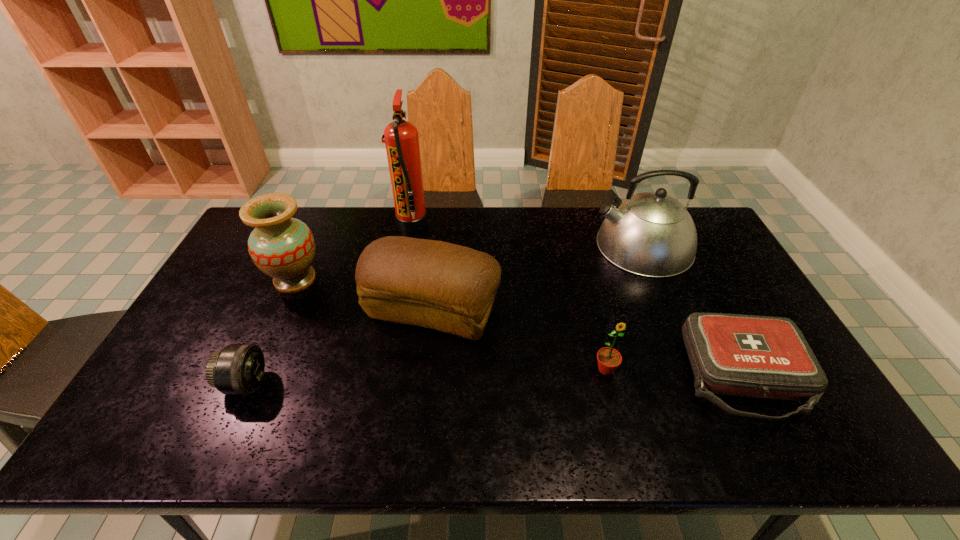
The width and height of the screenshot is (960, 540). What are the coordinates of `vacant space that satisfies the following two spatial constraints: 1. on the front side of the shortest object; 2. on the front-facing side of the telephoto lens` in the screenshot? It's located at (747, 383).

Where is `vacant space that satisfies the following two spatial constraints: 1. with the nozzle pointing from the back of the first-aid kit; 2. on the left side of the tallest object`? vacant space that satisfies the following two spatial constraints: 1. with the nozzle pointing from the back of the first-aid kit; 2. on the left side of the tallest object is located at coordinates (382, 376).

Where is `vacant region that satisfies the following two spatial constraints: 1. on the face of the first-aid kit; 2. on the left side of the fifth tallest object`? vacant region that satisfies the following two spatial constraints: 1. on the face of the first-aid kit; 2. on the left side of the fifth tallest object is located at coordinates click(608, 376).

This screenshot has height=540, width=960. In order to click on vacant space that satisfies the following two spatial constraints: 1. from the spout of the kettle; 2. on the front side of the vase in this screenshot , I will do `click(657, 280)`.

What are the coordinates of `free space that satisfies the following two spatial constraints: 1. on the face of the shortest object; 2. on the left side of the fifth tallest object` in the screenshot? It's located at (608, 376).